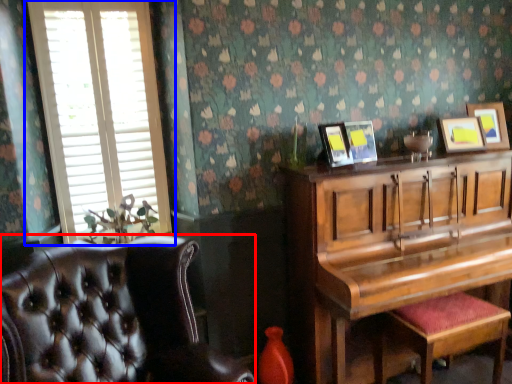
Question: Among these objects, which one is nearest to the camera, chair (highlighted by a red box) or window (highlighted by a blue box)?

Choices:
 (A) chair
 (B) window

Answer: (A)